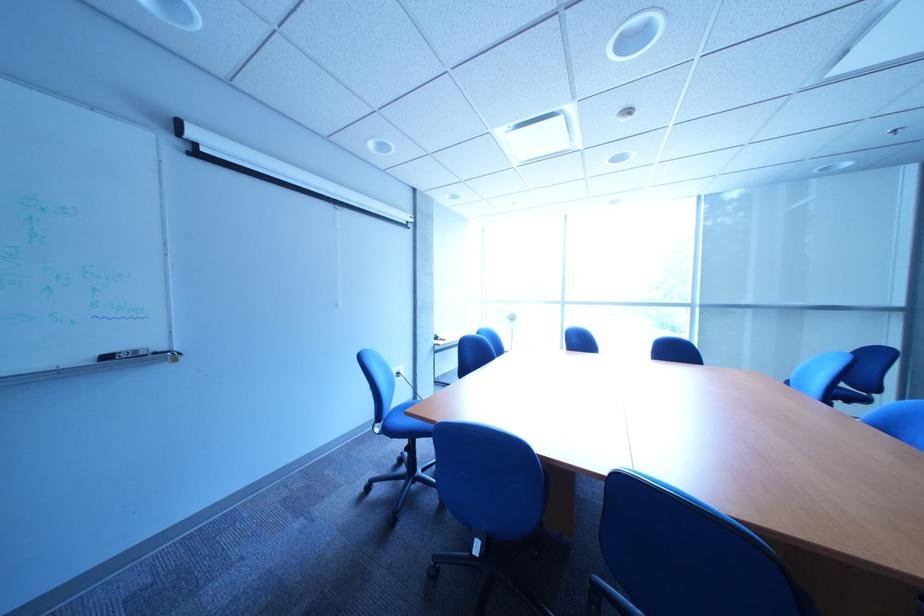
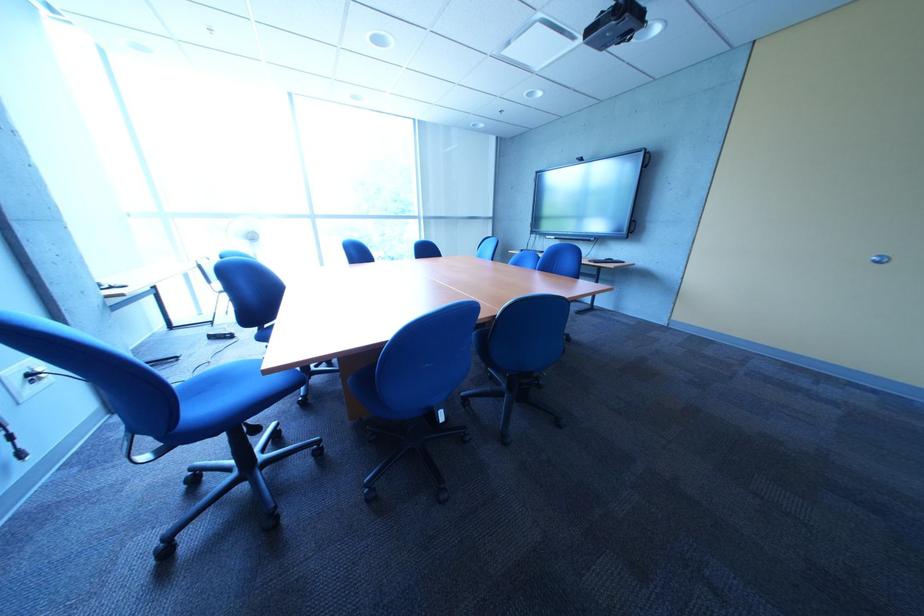
In the second image, find the point that corresponds to pixel 525 322 in the first image.

(262, 244)